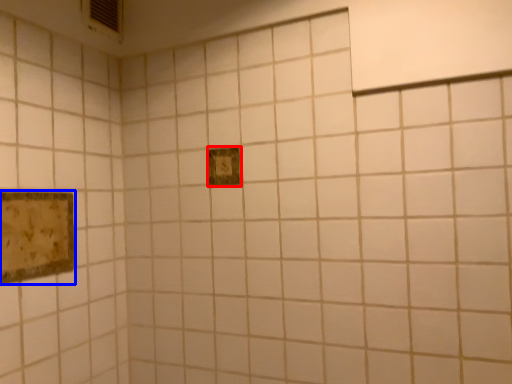
Question: Which object appears farthest to the camera in this image, picture frame (highlighted by a red box) or picture frame (highlighted by a blue box)?

Choices:
 (A) picture frame
 (B) picture frame

Answer: (A)